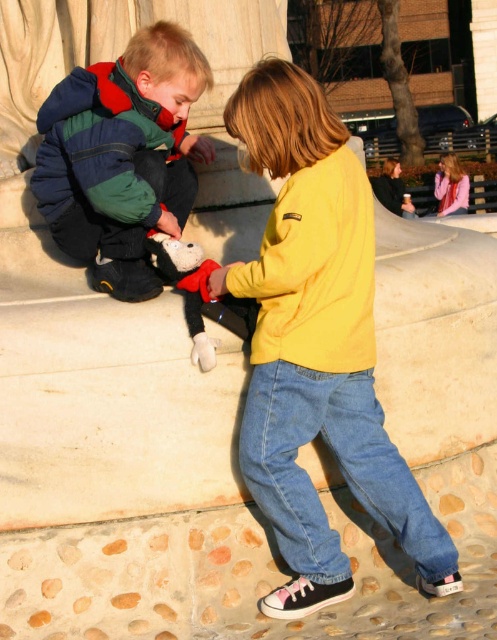
Who is more forward, (x=280, y=189) or (x=430, y=536)?

Point (x=430, y=536) is in front.

Is yellow fleece jacket at center closer to the viewer compared to denim jeans at lower center?

Yes.

Image resolution: width=497 pixels, height=640 pixels. Find the location of `yellow fleece jacket at center`. yellow fleece jacket at center is located at coordinates (317, 346).

Identify the location of yellow fleece jacket at center. (317, 346).

Is denim at left shorter than matte yellow jacket at center?

Yes, denim at left is shorter than matte yellow jacket at center.

Who is more distant from viewer, [154,179] or [466,211]?

The point [466,211] is behind.

Who is more distant from viewer, (165, 208) or (460, 186)?

The point (460, 186) is behind.

Where is `denim at left`? This screenshot has width=497, height=640. denim at left is located at coordinates (96, 234).

Which of these two, matte green jacket at lower left or denim at left, stands shorter?

With less height is denim at left.

I want to click on matte green jacket at lower left, so click(x=122, y=156).